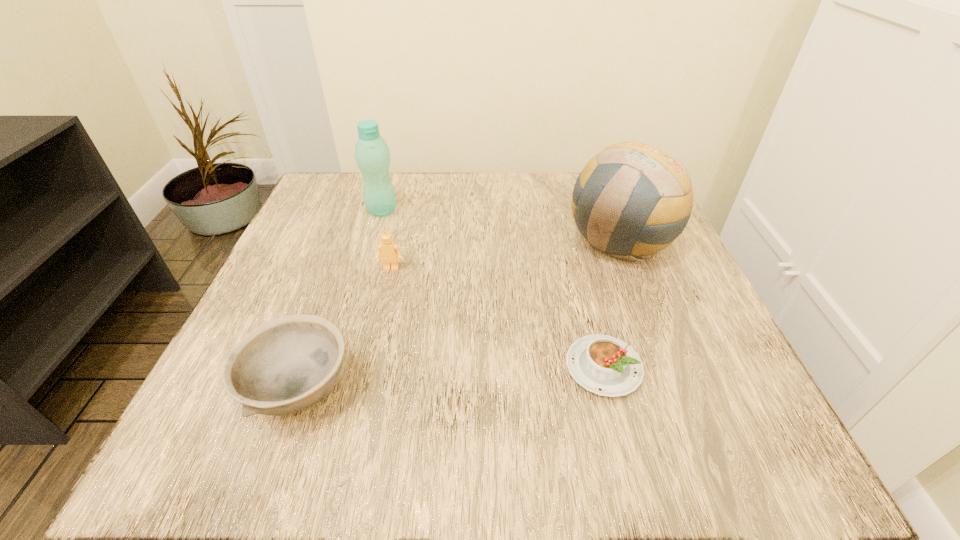
Locate an element on the screen. The height and width of the screenshot is (540, 960). volleyball is located at coordinates (632, 200).

Locate an element on the screen. bottle is located at coordinates (372, 154).

Where is `Lego`? This screenshot has width=960, height=540. Lego is located at coordinates (388, 251).

Find the location of a particular element. bowl is located at coordinates (285, 365).

The width and height of the screenshot is (960, 540). I want to click on the shortest object, so click(607, 366).

You are a GUI agent. You are given a task and a screenshot of the screen. Output one action in this format:
    pyautogui.click(x=<x>, y=<y>)
    Task: Click on the vacant region located 0.170m on the front of the volleyball
    
    Given the screenshot: What is the action you would take?
    tap(661, 347)

Locate an element on the screen. The height and width of the screenshot is (540, 960). vacant position located on the front of the bottle is located at coordinates (375, 233).

The height and width of the screenshot is (540, 960). Find the location of `vacant space located on the face of the Lego`. vacant space located on the face of the Lego is located at coordinates (378, 325).

The height and width of the screenshot is (540, 960). Identify the location of vacant region located on the right of the bowl. (401, 389).

Where is `free space located on the back of the pudding`? free space located on the back of the pudding is located at coordinates (582, 280).